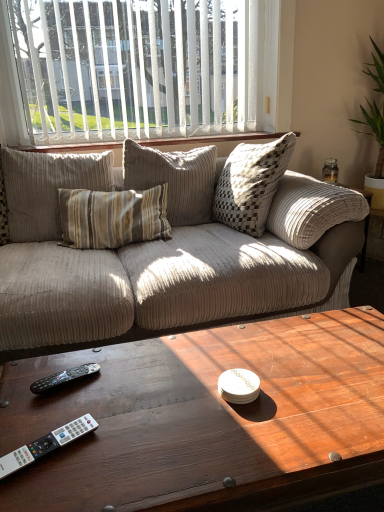
Find the location of `vacant space situated above wooden coffee table at center (from a real-world perspective)`. vacant space situated above wooden coffee table at center (from a real-world perspective) is located at coordinates (222, 395).